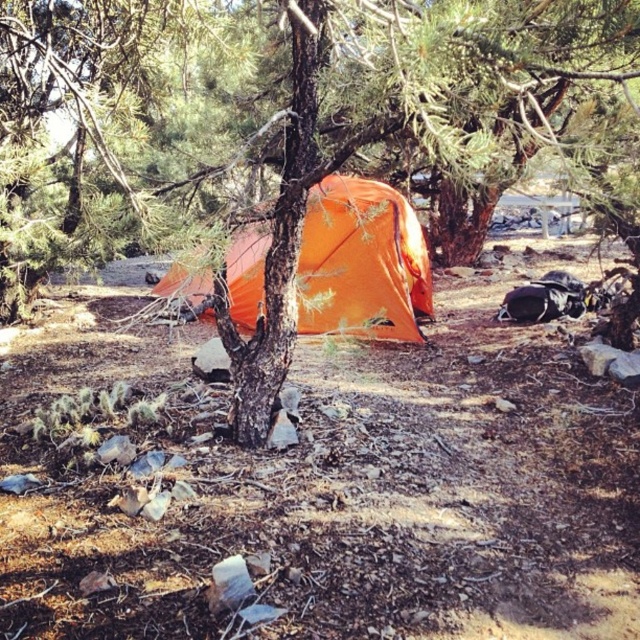
From the picture: You are a hiker who needs to set up a tent. You see the smooth bark tree at center and the orange fabric tent at center. Which one is shorter?

The smooth bark tree at center is not as tall as the orange fabric tent at center, so the smooth bark tree at center is shorter.

You are standing at the campsite and want to determine which of the two points, point (84,97) or point (378,218), is closer to you. Based on the scene, can you tell?

Point (84,97) is closer to the viewer than point (378,218).